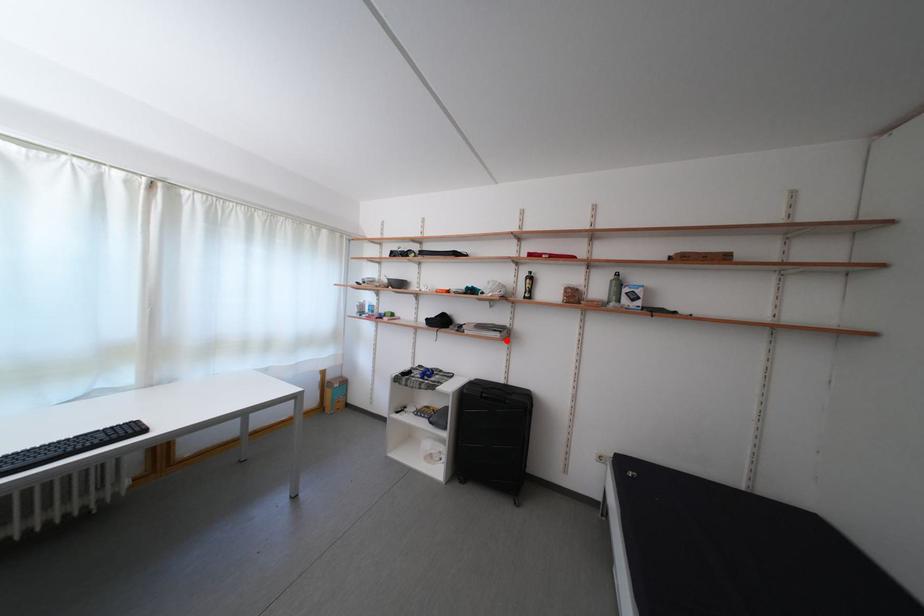
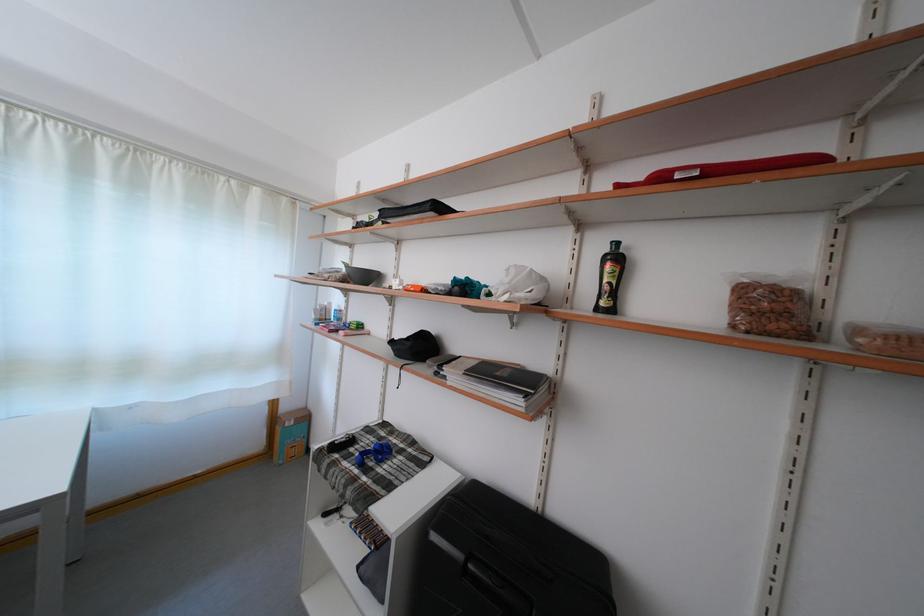
The point at the highlighted location is marked in the first image. Where is the corresponding point in the second image?

(527, 408)